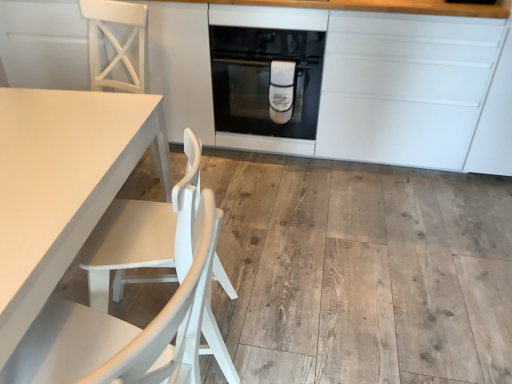
Question: Would you say white matte chair at left, placed as the second chair when sorted from bottom to top, is outside white matte cabinetry at center?

Choices:
 (A) yes
 (B) no

Answer: (A)

Question: From a real-world perspective, is white matte chair at left, placed as the second chair when sorted from bottom to top, over white matte cabinetry at center?

Choices:
 (A) no
 (B) yes

Answer: (B)

Question: Does white matte chair at left, placed as the second chair when sorted from bottom to top, have a greater height compared to white matte cabinetry at center?

Choices:
 (A) no
 (B) yes

Answer: (A)

Question: Is white matte chair at left, the second chair in the front-to-back sequence, positioned with its back to white matte cabinetry at center?

Choices:
 (A) yes
 (B) no

Answer: (A)

Question: From the image's perspective, is white matte chair at left, positioned as the first chair in back-to-front order, on top of white matte cabinetry at center?

Choices:
 (A) no
 (B) yes

Answer: (A)

Question: Is white matte table at left bigger or smaller than black glass oven at center?

Choices:
 (A) small
 (B) big

Answer: (B)

Question: From a real-world perspective, relative to black glass oven at center, is white matte table at left vertically above or below?

Choices:
 (A) above
 (B) below

Answer: (B)

Question: Considering the positions of white matte table at left and black glass oven at center in the image, is white matte table at left taller or shorter than black glass oven at center?

Choices:
 (A) short
 (B) tall

Answer: (B)

Question: Based on their positions, is white matte table at left located to the left or right of black glass oven at center?

Choices:
 (A) left
 (B) right

Answer: (A)

Question: Would you say black glass oven at center is to the left or to the right of white matte chair at left, the 1th chair positioned from the top, in the picture?

Choices:
 (A) right
 (B) left

Answer: (A)

Question: Is point (224, 44) closer or farther from the camera than point (119, 21)?

Choices:
 (A) closer
 (B) farther

Answer: (B)

Question: Considering their positions, is black glass oven at center located in front of or behind white matte chair at left, the 1th chair positioned from the top?

Choices:
 (A) front
 (B) behind

Answer: (B)

Question: In terms of height, does black glass oven at center look taller or shorter compared to white matte chair at left, the 1th chair positioned from the top?

Choices:
 (A) tall
 (B) short

Answer: (B)

Question: Considering the positions of white matte chair at left, placed as the second chair when sorted from bottom to top, and white matte table at left in the image, is white matte chair at left, placed as the second chair when sorted from bottom to top, taller or shorter than white matte table at left?

Choices:
 (A) tall
 (B) short

Answer: (B)

Question: Is point (100, 79) positioned closer to the camera than point (87, 193)?

Choices:
 (A) farther
 (B) closer

Answer: (A)